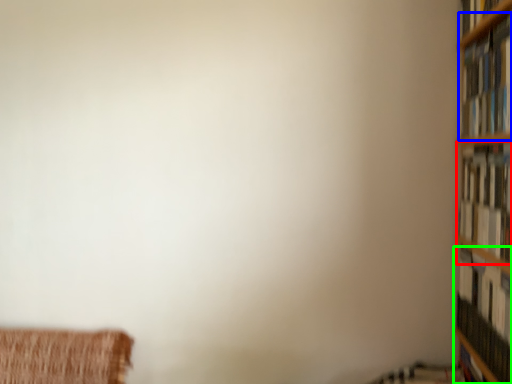
Question: Considering the real-world distances, which object is closest to book (highlighted by a red box)? book (highlighted by a blue box) or book (highlighted by a green box).

Choices:
 (A) book
 (B) book

Answer: (A)